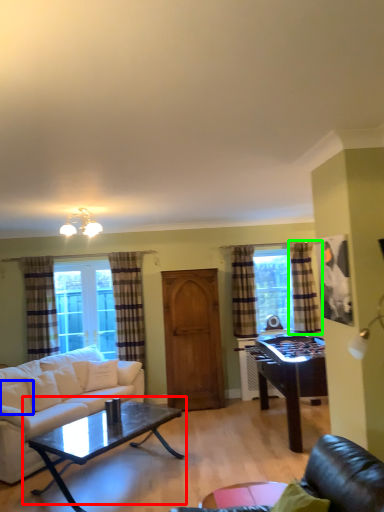
Question: Estimate the real-world distances between objects in this image. Which object is farther from coffee table (highlighted by a red box), pillow (highlighted by a blue box) or curtain (highlighted by a green box)?

Choices:
 (A) pillow
 (B) curtain

Answer: (B)